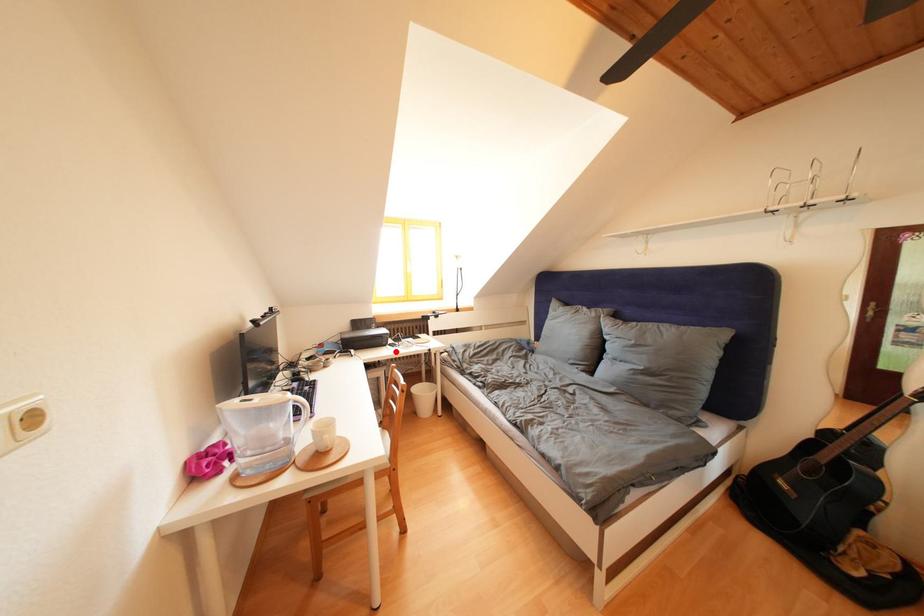
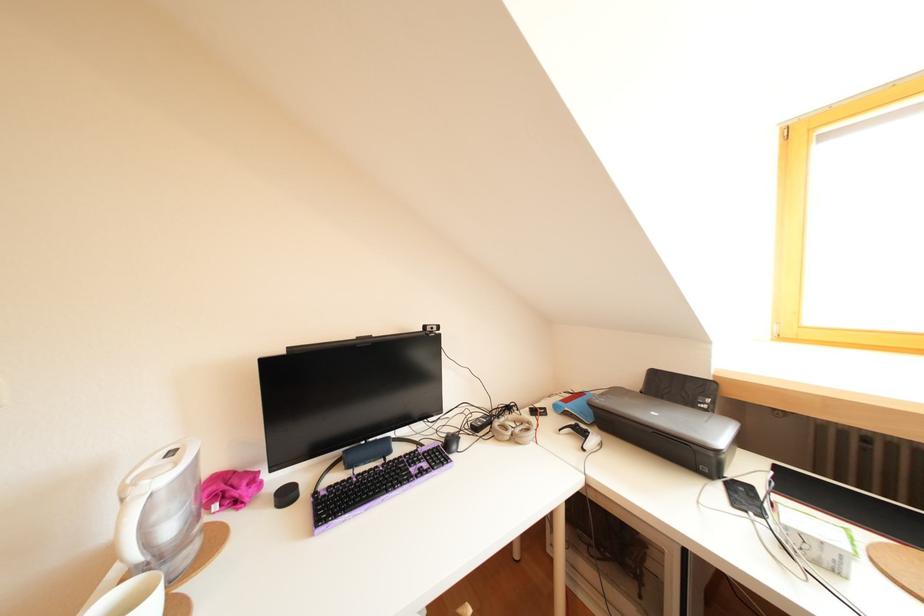
In the second image, find the point that corresponds to the highlighted location in the first image.

(727, 490)